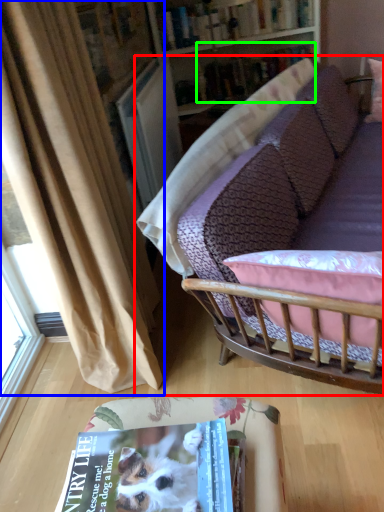
Question: Which object is positioned farthest from studio couch (highlighted by a red box)? Select from curtain (highlighted by a blue box) and book (highlighted by a green box).

Choices:
 (A) curtain
 (B) book

Answer: (B)